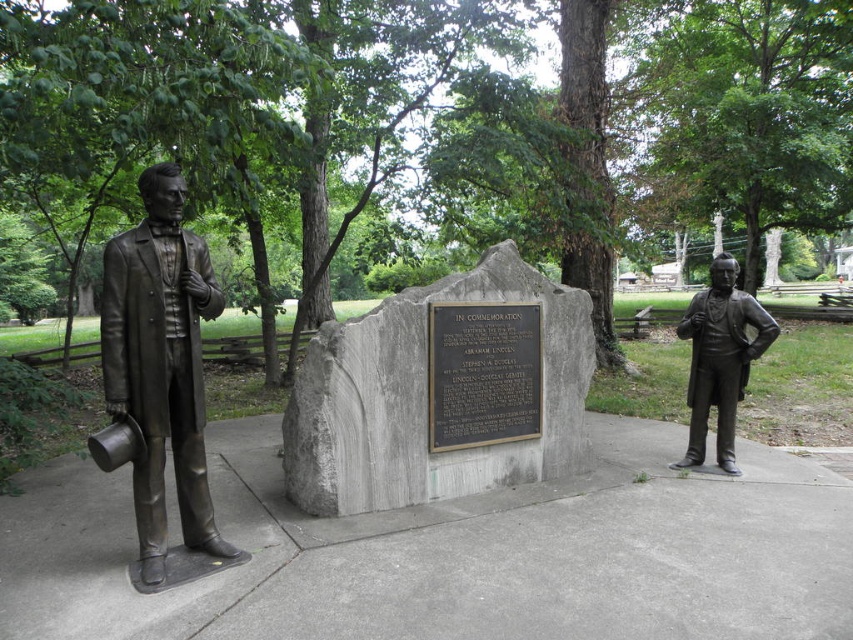
Question: Estimate the real-world distances between objects in this image. Which object is closer to the bronze statue at left?

Choices:
 (A) black polished stone plaque at center
 (B) bronze statue at right

Answer: (A)

Question: Which of the following is the farthest from the observer?

Choices:
 (A) bronze statue at right
 (B) black polished stone plaque at center
 (C) gray stone plaque at center
 (D) bronze statue at left

Answer: (A)

Question: Is black polished stone plaque at center smaller than bronze statue at right?

Choices:
 (A) yes
 (B) no

Answer: (A)

Question: Is bronze statue at left positioned behind black polished stone plaque at center?

Choices:
 (A) no
 (B) yes

Answer: (A)

Question: Among these objects, which one is farthest from the camera?

Choices:
 (A) bronze statue at right
 (B) black polished stone plaque at center
 (C) gray stone plaque at center

Answer: (A)

Question: Does black polished stone plaque at center come behind bronze statue at right?

Choices:
 (A) no
 (B) yes

Answer: (A)